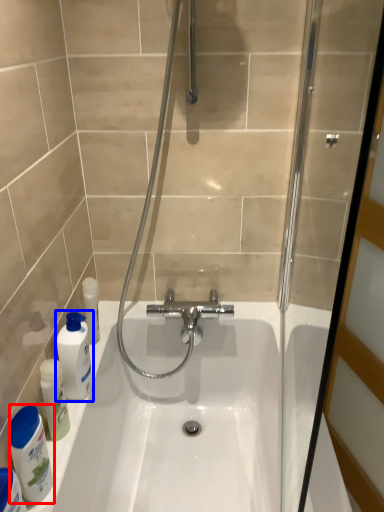
Question: Among these objects, which one is nearest to the camera, cleaning product (highlighted by a red box) or mouthwash (highlighted by a blue box)?

Choices:
 (A) cleaning product
 (B) mouthwash

Answer: (A)